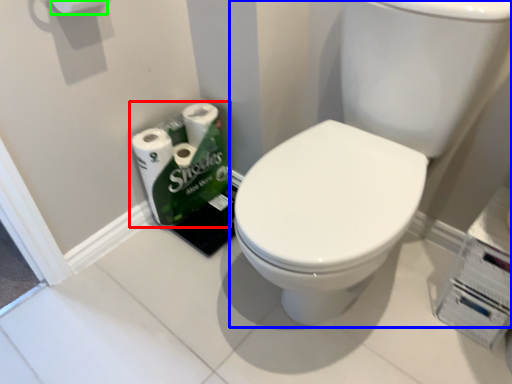
Question: Considering the real-world distances, which object is closest to toilet paper (highlighted by a red box)? sink (highlighted by a blue box) or toilet paper (highlighted by a green box).

Choices:
 (A) sink
 (B) toilet paper

Answer: (A)